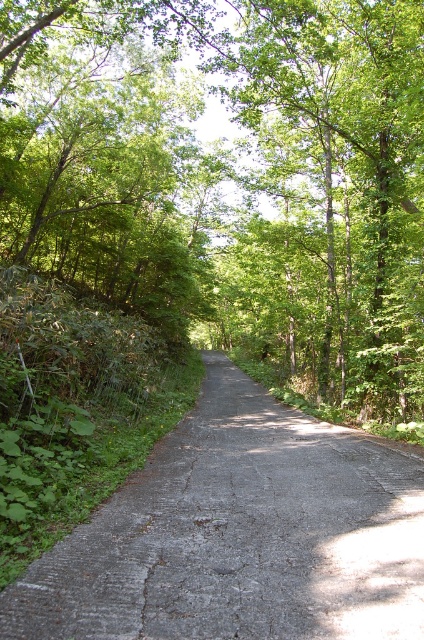
Question: Is green leafy tree at center to the right of gray asphalt road at center from the viewer's perspective?

Choices:
 (A) no
 (B) yes

Answer: (A)

Question: Which object appears farthest from the camera in this image?

Choices:
 (A) gray asphalt road at center
 (B) green leafy tree at center

Answer: (B)

Question: Does green leafy tree at center have a smaller size compared to gray asphalt road at center?

Choices:
 (A) yes
 (B) no

Answer: (B)

Question: Does green leafy tree at center have a greater width compared to gray asphalt road at center?

Choices:
 (A) no
 (B) yes

Answer: (B)

Question: Which object is closer to the camera taking this photo?

Choices:
 (A) green leafy tree at center
 (B) gray asphalt road at center

Answer: (B)

Question: Which object appears closest to the camera in this image?

Choices:
 (A) green leafy tree at center
 (B) gray asphalt road at center

Answer: (B)